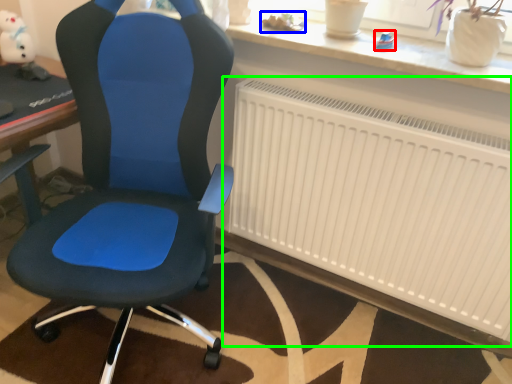
Question: Which object is positioned closest to toy (highlighted by a red box)? Select from toy (highlighted by a blue box) and radiator (highlighted by a green box).

Choices:
 (A) toy
 (B) radiator

Answer: (A)